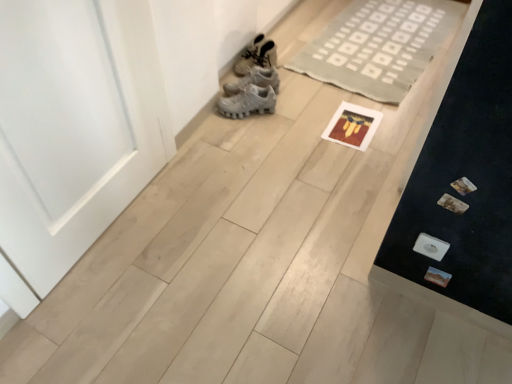
Image resolution: width=512 pixels, height=384 pixels. Identify the location of free space between white matte door at left and neutral woven rug at upper center. (265, 143).